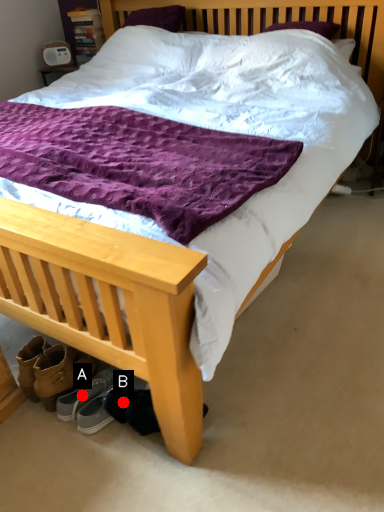
Question: Two points are circled on the image, labeled by A and B beside each circle. Which of the following is the farthest from the observer?

Choices:
 (A) A is further
 (B) B is further

Answer: (A)